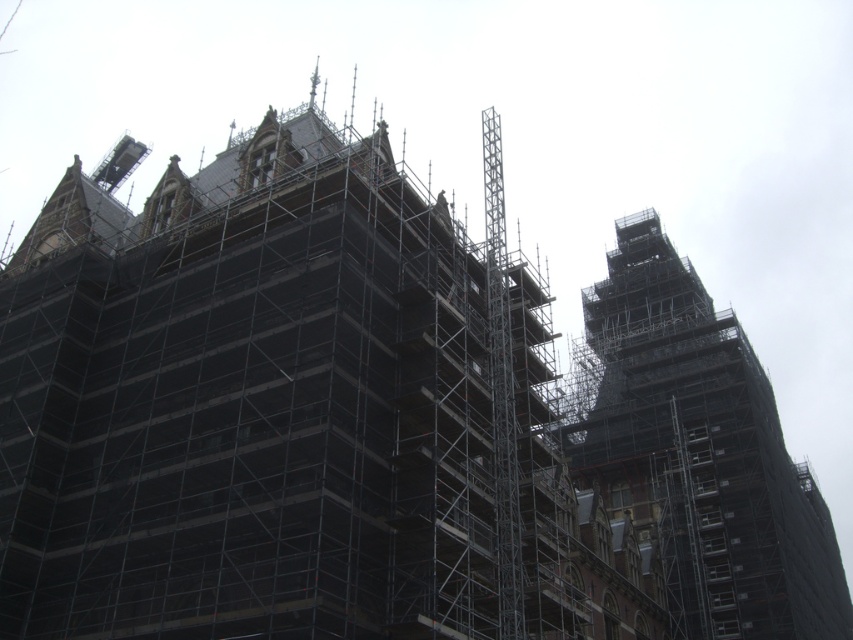
You are an architect inspecting the construction site of a Gothic building. You notice two types of scaffolding at the center of the building. Which one is closer to you, the metal scaffolding at center or the black scaffolding at center?

The metal scaffolding at center is closer to you because it is in front of the black scaffolding at center.

You are an inspector checking the construction site. You notice two types of scaffolding at the center of the building. The first is labeled as metal scaffolding at center, and the second is black scaffolding at center. Which one is narrower in width?

The metal scaffolding at center has a lesser width compared to the black scaffolding at center, so the metal scaffolding at center is narrower.

You are an inspector checking the safety of the scaffolding on a Gothic building. You notice two sections labeled as metal scaffolding at center and black scaffolding at center. Which one is positioned higher up on the building?

The metal scaffolding at center is positioned higher up on the building since it is located above the black scaffolding at center.